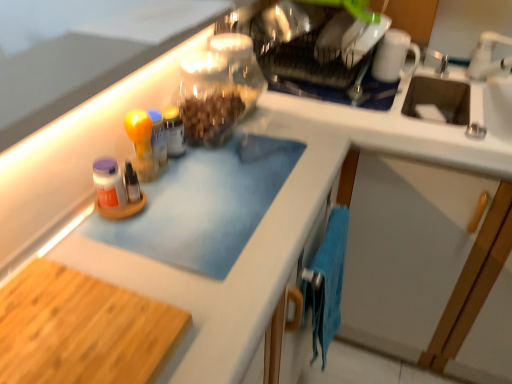
Where is `free space in front of white glossy mug at upper right`? The image size is (512, 384). free space in front of white glossy mug at upper right is located at coordinates (394, 108).